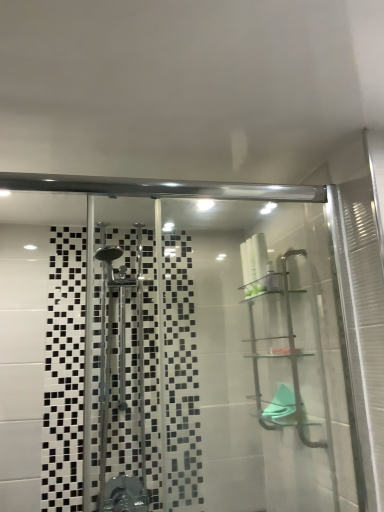
The width and height of the screenshot is (384, 512). Find the location of `clear glass shelf at upper right`. clear glass shelf at upper right is located at coordinates (289, 358).

What do you see at coordinates (289, 358) in the screenshot? The height and width of the screenshot is (512, 384). I see `clear glass shelf at upper right` at bounding box center [289, 358].

What are the coordinates of `clear glass shelf at upper right` in the screenshot? It's located at (289, 358).